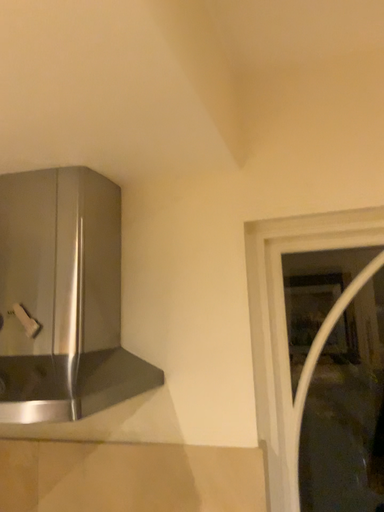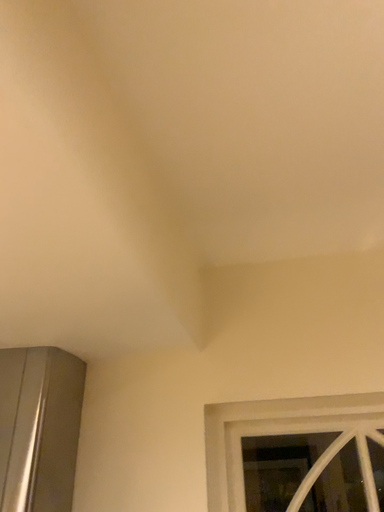
Question: How did the camera likely rotate when shooting the video?

Choices:
 (A) rotated downward
 (B) rotated upward

Answer: (B)